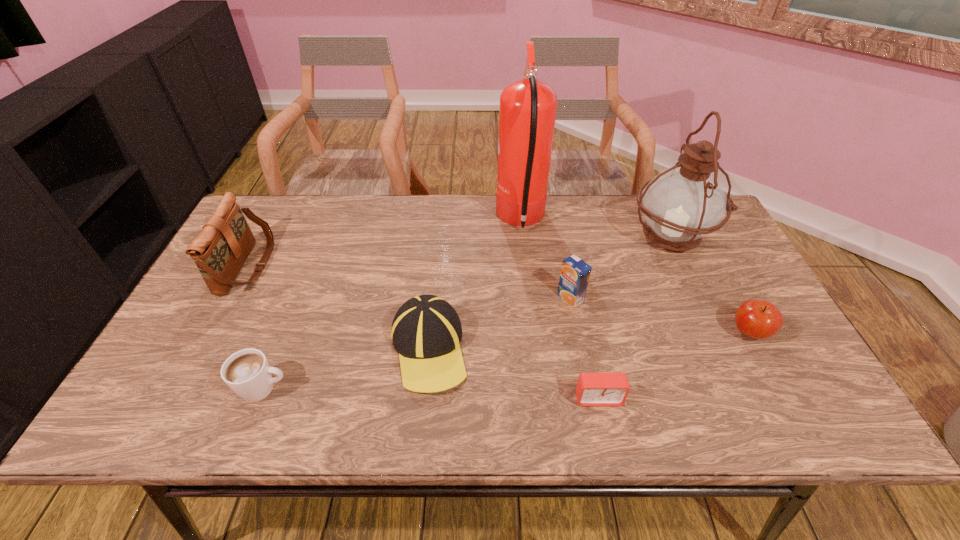
The image size is (960, 540). I want to click on shoulder bag that is at the far edge, so click(x=220, y=250).

Where is `baseball cap that is at the near edge`? The image size is (960, 540). baseball cap that is at the near edge is located at coordinates (426, 331).

Where is `cappuccino located at the near edge`? The width and height of the screenshot is (960, 540). cappuccino located at the near edge is located at coordinates (247, 372).

Identify the location of alarm clock located in the near edge section of the desktop. (592, 389).

The width and height of the screenshot is (960, 540). I want to click on object at the left edge, so click(x=220, y=250).

This screenshot has height=540, width=960. I want to click on oil lamp that is at the right edge, so click(680, 205).

At what (x,y) coordinates should I click in order to perform the action: click on apple present at the right edge. Please return your answer as a coordinate pair (x, y). Looking at the image, I should click on (758, 319).

The width and height of the screenshot is (960, 540). Find the location of `object present at the far left corner`. object present at the far left corner is located at coordinates (220, 250).

The width and height of the screenshot is (960, 540). Identify the location of object that is positioned at the far right corner. (680, 205).

Locate an element on the screen. Image resolution: width=960 pixels, height=540 pixels. vacant area at the far edge is located at coordinates (385, 235).